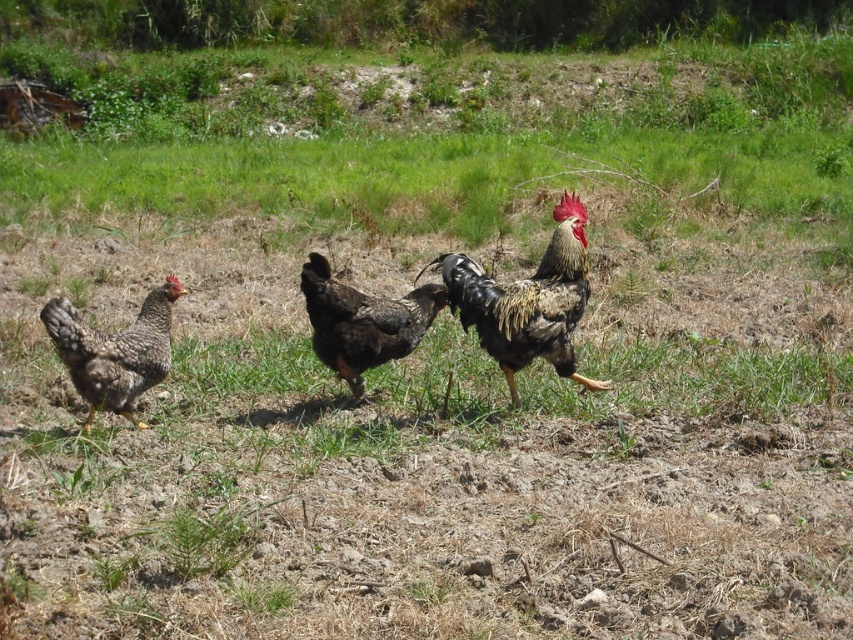
Question: Can you confirm if black glossy rooster at center is positioned above speckled feathered chicken at left?

Choices:
 (A) yes
 (B) no

Answer: (A)

Question: Which point is closer to the camera?

Choices:
 (A) speckled feathered chicken at center
 (B) black glossy rooster at center
 (C) speckled feathered chicken at left

Answer: (C)

Question: Does black glossy rooster at center appear under speckled feathered chicken at left?

Choices:
 (A) yes
 (B) no

Answer: (B)

Question: Among these objects, which one is farthest from the camera?

Choices:
 (A) speckled feathered chicken at center
 (B) black glossy rooster at center

Answer: (A)

Question: Which point is closer to the camera?

Choices:
 (A) (320, 253)
 (B) (149, 356)

Answer: (B)

Question: Is black glossy rooster at center bigger than speckled feathered chicken at left?

Choices:
 (A) yes
 (B) no

Answer: (A)